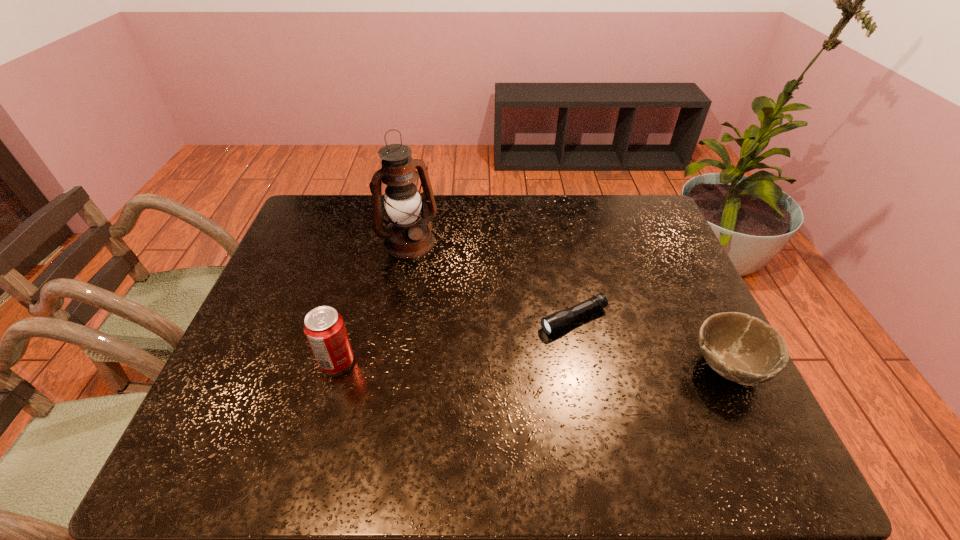
Find the location of a particular element. This screenshot has height=540, width=960. vacant spot on the desktop that is between the soda and the rightmost object and is positioned at the lens end of the flashlight is located at coordinates (479, 364).

Image resolution: width=960 pixels, height=540 pixels. I want to click on free space on the desktop that is between the soda and the bowl and is positioned on the side of the lantern, there is a wick adjustment knob, so click(x=503, y=364).